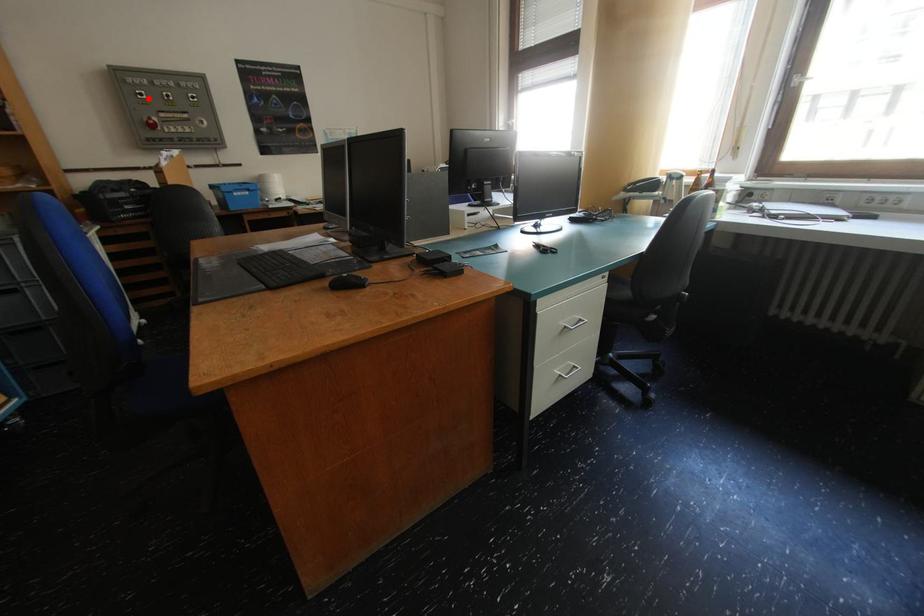
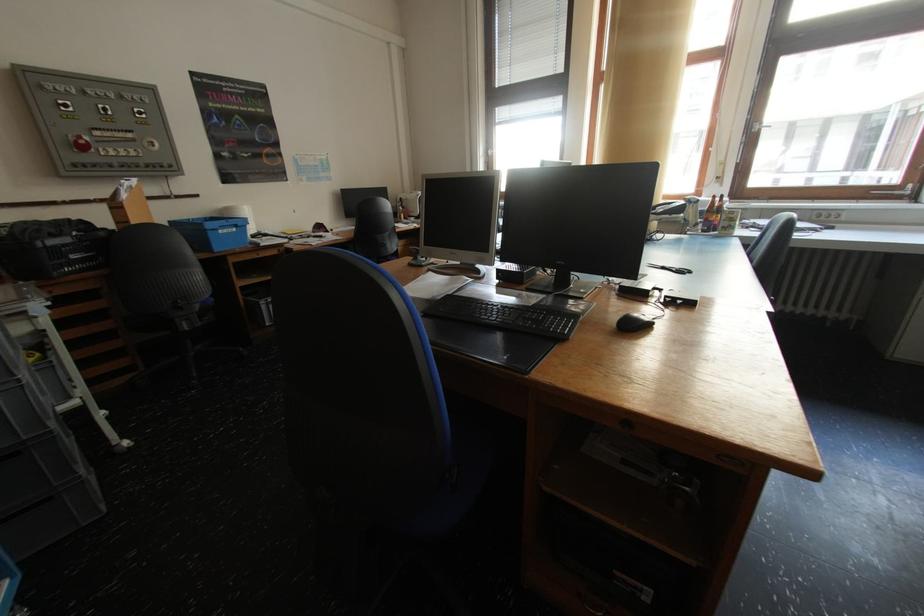
Question: I am providing you with two images of the same scene from different viewpoints. Given a red point in image1, look at the same physical point in image2. Is it:

Choices:
 (A) Closer to the viewpoint
 (B) Farther from the viewpoint

Answer: (B)